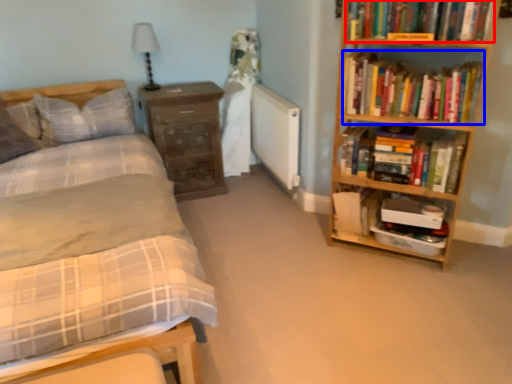
Question: Which object is further to the camera taking this photo, book (highlighted by a red box) or book (highlighted by a blue box)?

Choices:
 (A) book
 (B) book

Answer: (B)